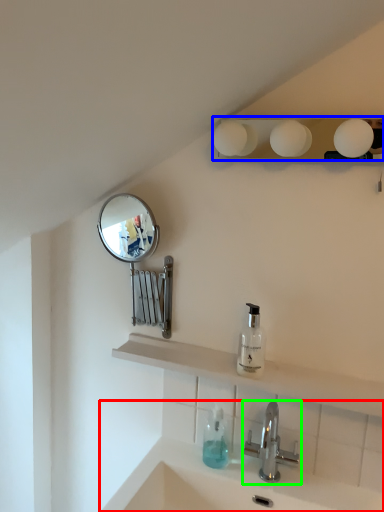
Question: Which object is positioned closest to sink (highlighted by a red box)? Select from lighting (highlighted by a blue box) and tap (highlighted by a green box).

Choices:
 (A) lighting
 (B) tap

Answer: (B)